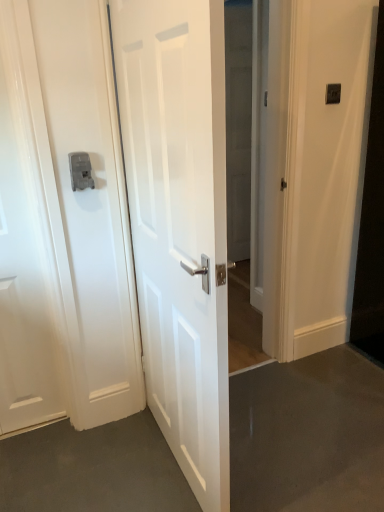
Question: Does point (329, 99) appear closer or farther from the camera than point (241, 197)?

Choices:
 (A) closer
 (B) farther

Answer: (A)

Question: Is black plastic light switch at upper right in front of or behind transparent glass door at center in the image?

Choices:
 (A) behind
 (B) front

Answer: (B)

Question: Which is farther from the transparent glass door at center?

Choices:
 (A) black plastic light switch at upper right
 (B) white glossy door at center, positioned as the 1th door in right-to-left order
 (C) satin silver latch at left
 (D) white glossy door at left, arranged as the 2th door when viewed from the right

Answer: (D)

Question: Which object is positioned farthest from the satin silver latch at left?

Choices:
 (A) black plastic light switch at upper right
 (B) white glossy door at center, positioned as the 1th door in right-to-left order
 (C) transparent glass door at center
 (D) white glossy door at left, arranged as the 2th door when viewed from the right

Answer: (A)